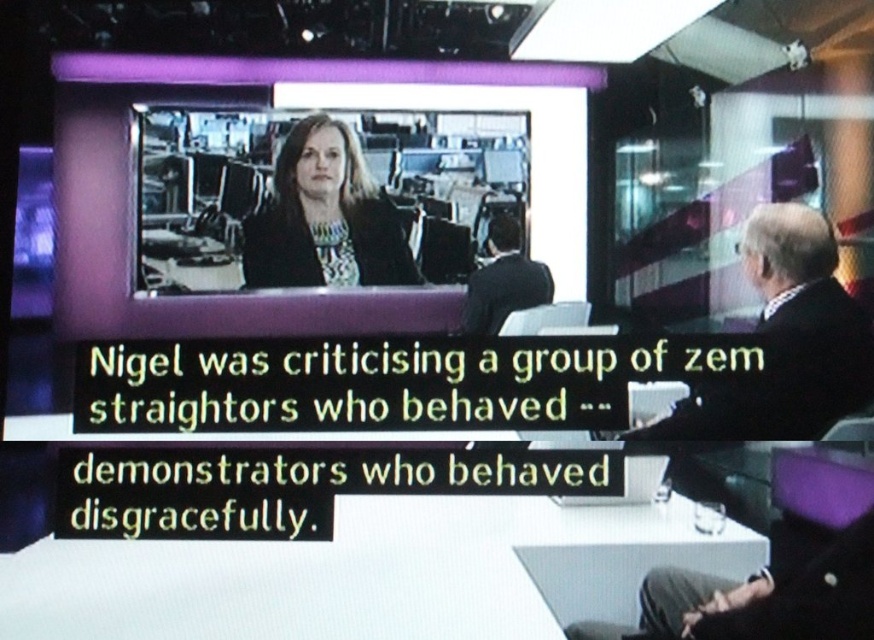
Question: Which point is closer to the camera?

Choices:
 (A) (365, 221)
 (B) (318, 188)
 (C) (546, 285)
 (D) (754, 380)

Answer: (D)

Question: Among these points, which one is nearest to the camera?

Choices:
 (A) (521, 186)
 (B) (833, 308)

Answer: (B)

Question: Does black wool suit at right have a lesser width compared to dark suit at center?

Choices:
 (A) no
 (B) yes

Answer: (A)

Question: Can you confirm if matte black laptop at upper center is positioned to the left of matte black jacket at center?

Choices:
 (A) no
 (B) yes

Answer: (A)

Question: Which of these objects is positioned closest to the black wool suit at right?

Choices:
 (A) matte black laptop at upper center
 (B) matte black jacket at center

Answer: (A)

Question: In this image, where is black wool suit at right located relative to matte black jacket at center?

Choices:
 (A) left
 (B) right

Answer: (B)